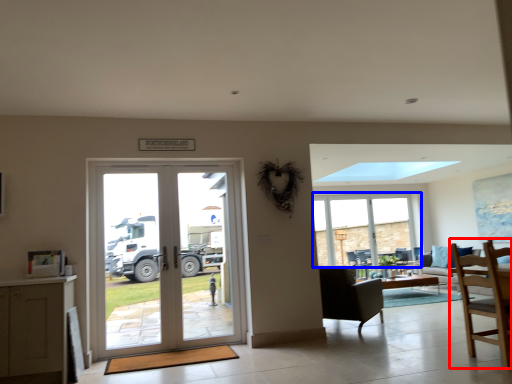
Question: Among these objects, which one is nearest to the camera, chair (highlighted by a red box) or window (highlighted by a blue box)?

Choices:
 (A) chair
 (B) window

Answer: (A)